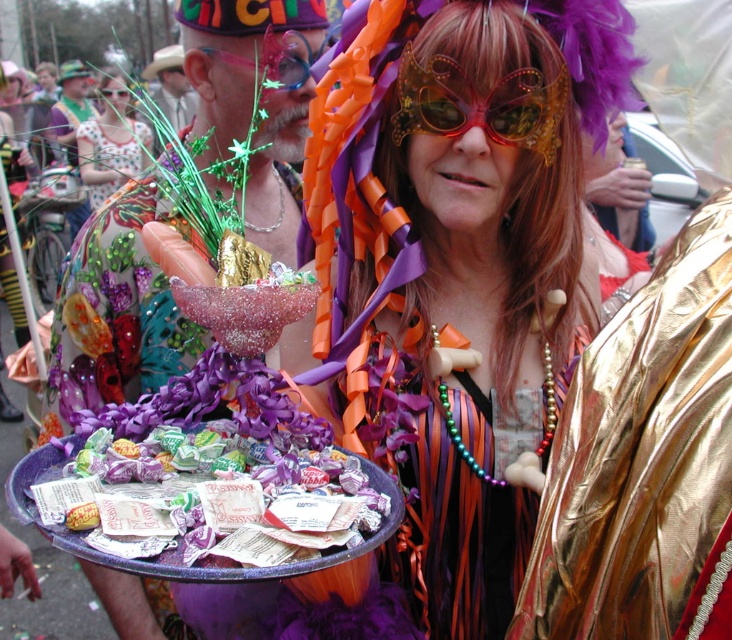
Does shiny metallic tray at center have a larger size compared to metallic gold goggles at center?

Yes.

Looking at this image, can you confirm if shiny metallic tray at center is wider than metallic gold goggles at center?

Yes, shiny metallic tray at center is wider than metallic gold goggles at center.

Is point (123, 589) positioned before point (116, 92)?

Yes.

I want to click on shiny metallic tray at center, so click(253, 97).

Is gold textured goggles at center behind polka dot fabric dress at upper left?

No.

Does gold textured goggles at center have a lesser width compared to polka dot fabric dress at upper left?

Yes, gold textured goggles at center is thinner than polka dot fabric dress at upper left.

Is point (534, 141) less distant than point (86, 176)?

Yes, point (534, 141) is in front of point (86, 176).

Locate an element on the screen. gold textured goggles at center is located at coordinates (479, 104).

Is point (247, 68) positioned behind point (67, 116)?

No, (247, 68) is closer to viewer.

Which of these two, shiny metallic tray at center or brushed metal hat at upper left, stands taller?

brushed metal hat at upper left is taller.

Is point (231, 77) closer to camera compared to point (74, 72)?

Yes, point (231, 77) is closer to viewer.

This screenshot has width=732, height=640. What are the coordinates of `shiny metallic tray at center` in the screenshot? It's located at (253, 97).